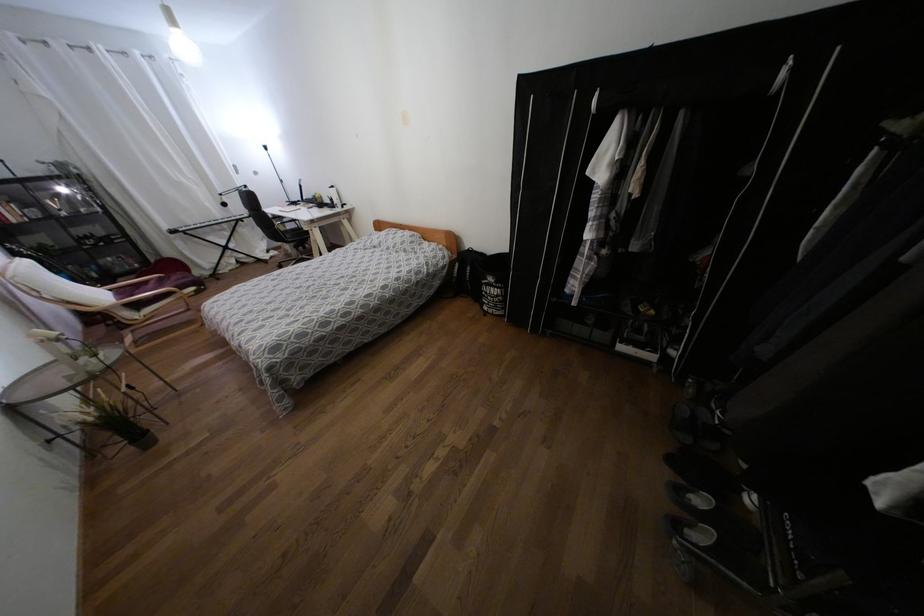
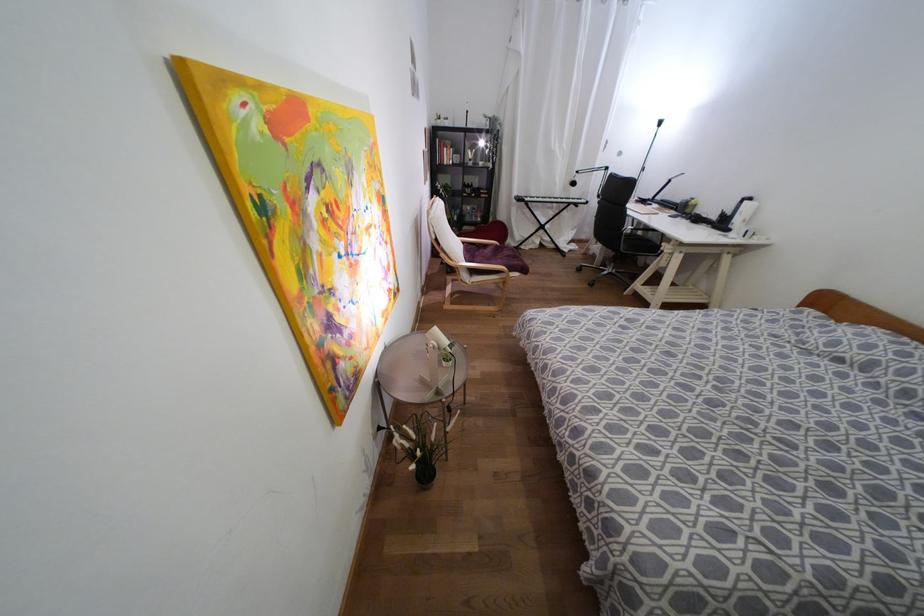
Find the pixel in the second image that matches point 63,190 in the first image.

(480, 143)